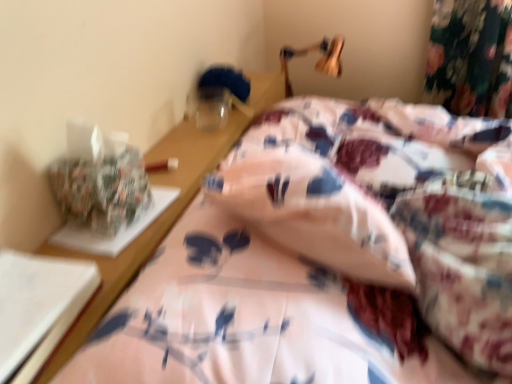
Question: Can you confirm if floral fabric bed at center is shorter than wooden table lamp at upper center?

Choices:
 (A) yes
 (B) no

Answer: (A)

Question: Does floral fabric bed at center appear on the left side of wooden table lamp at upper center?

Choices:
 (A) no
 (B) yes

Answer: (B)

Question: Is floral fabric bed at center oriented away from wooden table lamp at upper center?

Choices:
 (A) yes
 (B) no

Answer: (B)

Question: Does floral fabric bed at center have a greater width compared to wooden table lamp at upper center?

Choices:
 (A) no
 (B) yes

Answer: (B)

Question: Can you confirm if floral fabric bed at center is positioned to the right of wooden table lamp at upper center?

Choices:
 (A) no
 (B) yes

Answer: (A)

Question: Is floral fabric bed at center taller than wooden table lamp at upper center?

Choices:
 (A) yes
 (B) no

Answer: (B)

Question: Is wooden table lamp at upper center to the left of floral fabric bed at center from the viewer's perspective?

Choices:
 (A) yes
 (B) no

Answer: (B)

Question: Is the depth of wooden table lamp at upper center greater than that of floral fabric bed at center?

Choices:
 (A) yes
 (B) no

Answer: (A)

Question: From a real-world perspective, is wooden table lamp at upper center on floral fabric bed at center?

Choices:
 (A) yes
 (B) no

Answer: (B)

Question: Can you confirm if wooden table lamp at upper center is shorter than floral fabric bed at center?

Choices:
 (A) yes
 (B) no

Answer: (B)

Question: Could floral fabric bed at center be considered to be inside wooden table lamp at upper center?

Choices:
 (A) no
 (B) yes

Answer: (A)

Question: Is floral fabric bed at center at the back of wooden table lamp at upper center?

Choices:
 (A) no
 (B) yes

Answer: (A)

Question: Is wooden table lamp at upper center inside the boundaries of floral fabric bed at center, or outside?

Choices:
 (A) outside
 (B) inside

Answer: (A)